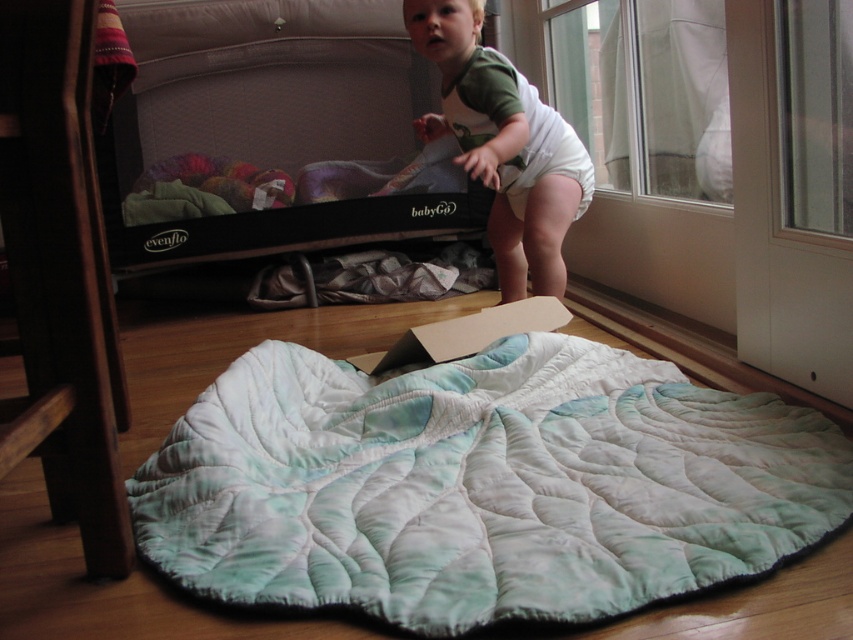
Question: Estimate the real-world distances between objects in this image. Which object is farther from the quilted fabric at lower center?

Choices:
 (A) white cloth diaper at upper center
 (B) black fabric playpen at upper center

Answer: (B)

Question: Which object is farther from the camera taking this photo?

Choices:
 (A) white cloth diaper at upper center
 (B) quilted fabric at lower center

Answer: (A)

Question: Is quilted fabric at lower center thinner than black fabric playpen at upper center?

Choices:
 (A) no
 (B) yes

Answer: (B)

Question: Is quilted fabric at lower center below white cloth diaper at upper center?

Choices:
 (A) no
 (B) yes

Answer: (B)

Question: Which object is farther from the camera taking this photo?

Choices:
 (A) black fabric playpen at upper center
 (B) quilted fabric at lower center

Answer: (A)

Question: Is quilted fabric at lower center above white cloth diaper at upper center?

Choices:
 (A) no
 (B) yes

Answer: (A)